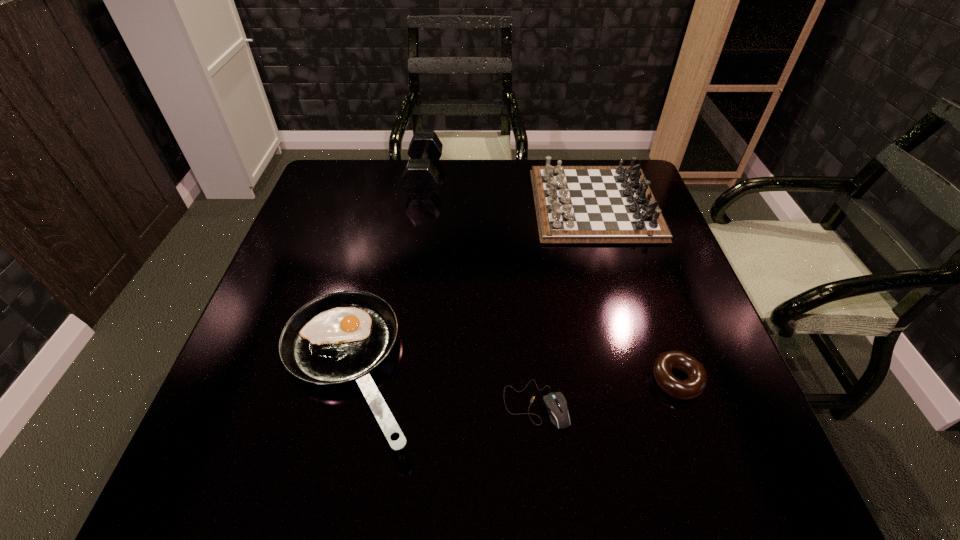
In the image, there is a desktop. Identify the location of vacant space at the far edge. (455, 169).

Find the location of a particular element. This screenshot has height=540, width=960. free spot at the near edge of the desktop is located at coordinates (624, 451).

In the image, there is a desktop. Where is `vacant space at the left edge`? vacant space at the left edge is located at coordinates (267, 389).

In the image, there is a desktop. At what (x,y) coordinates should I click in order to perform the action: click on vacant space at the right edge. Please return your answer as a coordinate pair (x, y). The width and height of the screenshot is (960, 540). Looking at the image, I should click on (671, 405).

The height and width of the screenshot is (540, 960). What are the coordinates of `blank space at the near left corner` in the screenshot? It's located at coord(226,458).

Where is `free point at the far right corner`? The width and height of the screenshot is (960, 540). free point at the far right corner is located at coordinates (583, 160).

Where is `vacant area at the near right corner of the desktop`? The width and height of the screenshot is (960, 540). vacant area at the near right corner of the desktop is located at coordinates (695, 456).

The height and width of the screenshot is (540, 960). Identify the location of vacant region between the second tallest object and the shortest object. (565, 303).

The image size is (960, 540). In order to click on empty space between the third shortest object and the chessboard in this screenshot , I will do `click(471, 287)`.

Locate an element on the screen. vacant point located between the computer mouse and the frying pan is located at coordinates (442, 387).